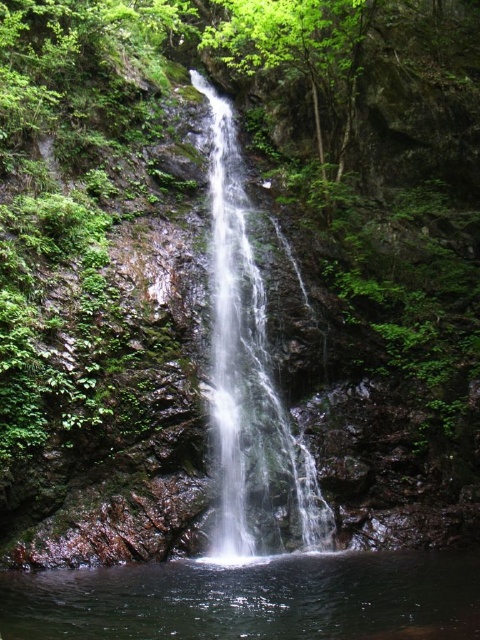
Question: Does clear liquid water at bottom center have a lesser width compared to clear water at center?

Choices:
 (A) no
 (B) yes

Answer: (A)

Question: Considering the relative positions of clear liquid water at bottom center and clear water at center in the image provided, where is clear liquid water at bottom center located with respect to clear water at center?

Choices:
 (A) left
 (B) right

Answer: (B)

Question: Which object appears closest to the camera in this image?

Choices:
 (A) clear liquid water at bottom center
 (B) clear water at center

Answer: (A)

Question: Which point is farther to the camera?

Choices:
 (A) (219, 320)
 (B) (460, 612)

Answer: (A)

Question: Can you confirm if clear liquid water at bottom center is bigger than clear water at center?

Choices:
 (A) yes
 (B) no

Answer: (B)